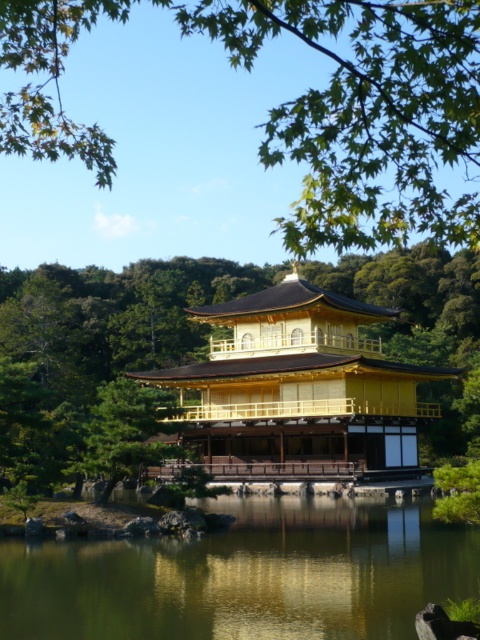
You are standing in front of the Kinkakuji pavilion. You see a green leafy tree at upper center and a green reflective water at center. Which object is nearer to you?

The green leafy tree at upper center is closer to the viewer than the green reflective water at center.

You are a tourist standing in front of the Golden Pavilion. You notice a green leafy tree at upper center and a green reflective water at center. Which object is positioned higher in the scene?

The green leafy tree at upper center is located above the green reflective water at center, so it is positioned higher in the scene.

You are standing in front of the Golden Pavilion and notice two points marked on the structure. The first point is at coordinates point (364,516) and the second is at point (409,401). Which of these points is closer to your current position?

Point (364,516) is closer to the camera than point (409,401), so the first point is closer to your current position.